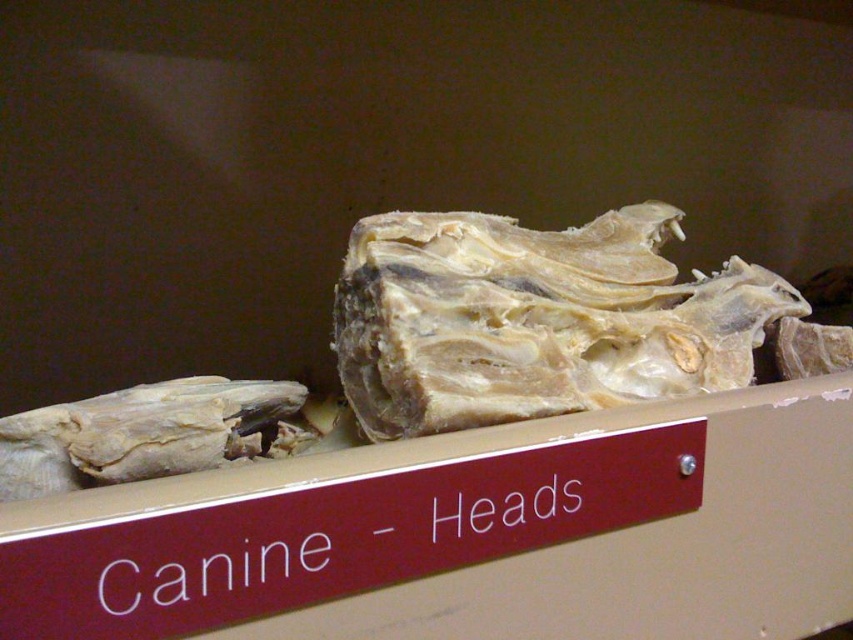
The height and width of the screenshot is (640, 853). Describe the element at coordinates (477, 532) in the screenshot. I see `white cardboard box at center` at that location.

Does white cardboard box at center appear on the left side of white fibrous bone at center?

Correct, you'll find white cardboard box at center to the left of white fibrous bone at center.

Where is `white cardboard box at center`? white cardboard box at center is located at coordinates (477, 532).

At what (x,y) coordinates should I click in order to perform the action: click on white cardboard box at center. Please return your answer as a coordinate pair (x, y). The height and width of the screenshot is (640, 853). Looking at the image, I should click on (477, 532).